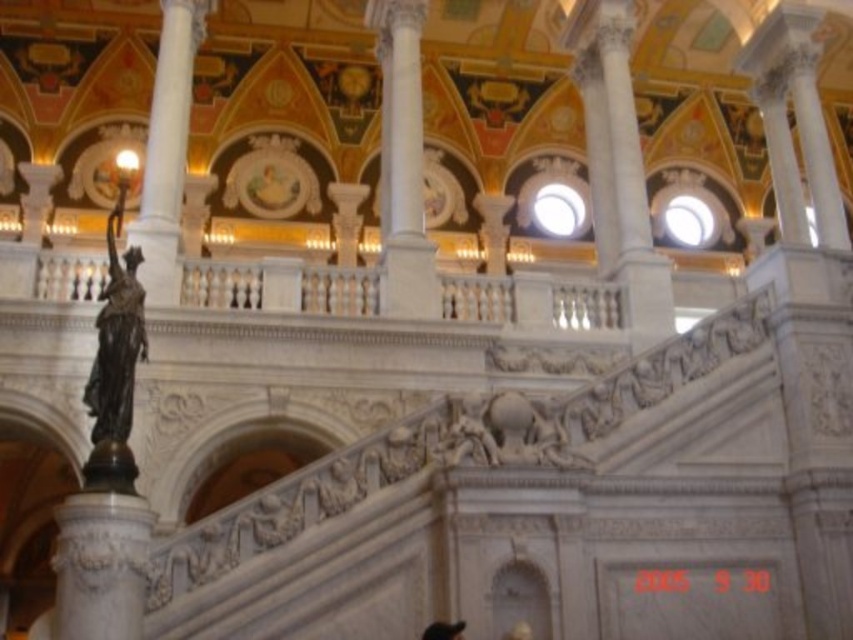
Question: Which object is closer to the camera taking this photo?

Choices:
 (A) bronze statue at left
 (B) white marble column at upper center

Answer: (A)

Question: Which point is farther from the camera taking this photo?

Choices:
 (A) (190, 72)
 (B) (128, 390)
 (C) (421, 300)
 (D) (422, 632)

Answer: (A)

Question: Which point is farther from the camera taking this photo?

Choices:
 (A) (393, 81)
 (B) (422, 634)

Answer: (A)

Question: Does white marble column at center appear under black hair at lower center?

Choices:
 (A) yes
 (B) no

Answer: (B)

Question: Is white marble column at center thinner than black hair at lower center?

Choices:
 (A) no
 (B) yes

Answer: (A)

Question: Is white marble column at center thinner than black hair at lower center?

Choices:
 (A) no
 (B) yes

Answer: (A)